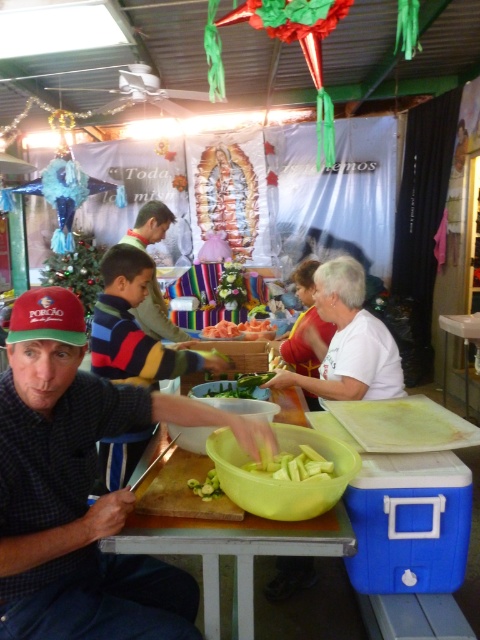
Question: Among these points, which one is farthest from the camera?

Choices:
 (A) (250, 324)
 (B) (155, 333)
 (C) (386, 369)

Answer: (B)

Question: Is white matte shirt at center thinner than orange fleshed fruit at center?

Choices:
 (A) no
 (B) yes

Answer: (A)

Question: Observing the image, what is the correct spatial positioning of green rubbery vegetable at center in reference to green matte cucumber at center?

Choices:
 (A) left
 (B) right

Answer: (B)

Question: In this image, where is striped sweater at center located relative to green matte cucumber at center?

Choices:
 (A) below
 (B) above

Answer: (B)

Question: Which of these objects is positioned farthest from the green rubbery vegetable at center?

Choices:
 (A) red cap at left
 (B) white matte shirt at center
 (C) green matte cucumber at center
 (D) striped sweater at center

Answer: (D)

Question: Among these objects, which one is nearest to the camera?

Choices:
 (A) striped sweater at center
 (B) green rubbery vegetable at center
 (C) white plastic table at center
 (D) orange fleshed fruit at center

Answer: (B)